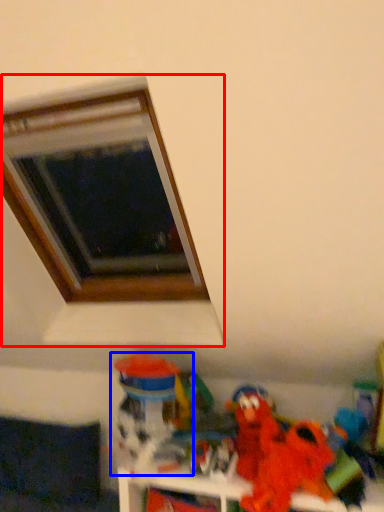
Question: Which of the following is the closest to the observer, window (highlighted by a red box) or toy (highlighted by a blue box)?

Choices:
 (A) window
 (B) toy

Answer: (A)